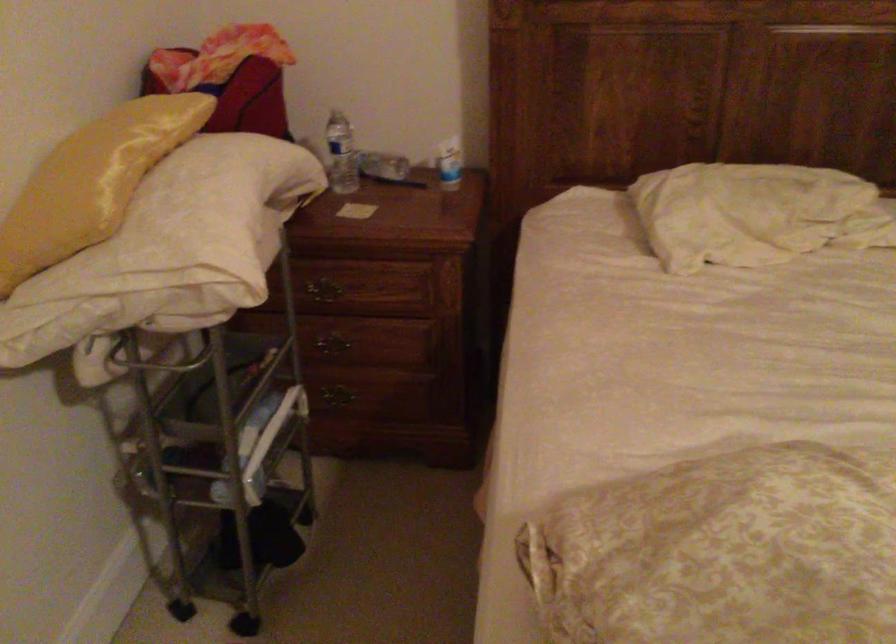
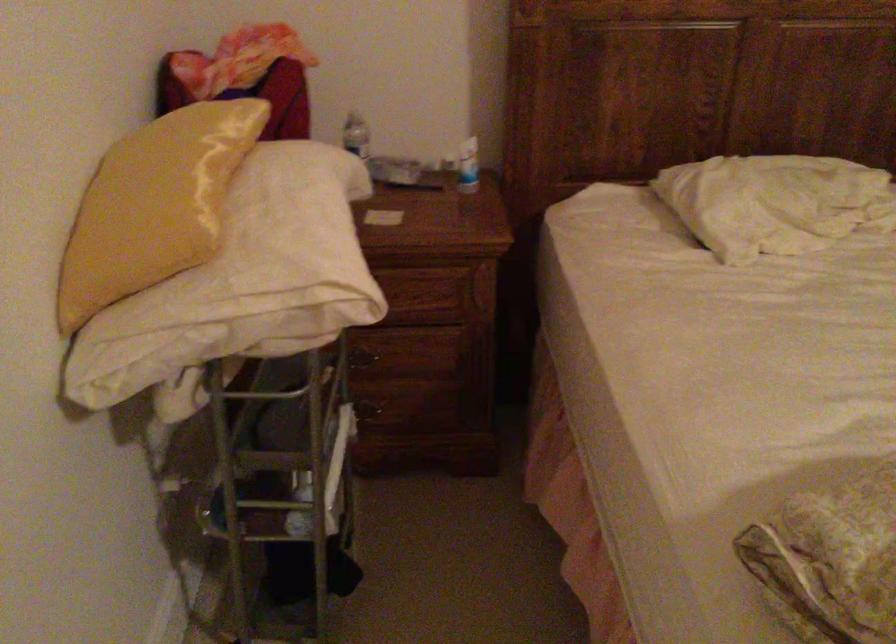
In the second image, find the point that corresponds to the point at 735,211 in the first image.

(774, 202)